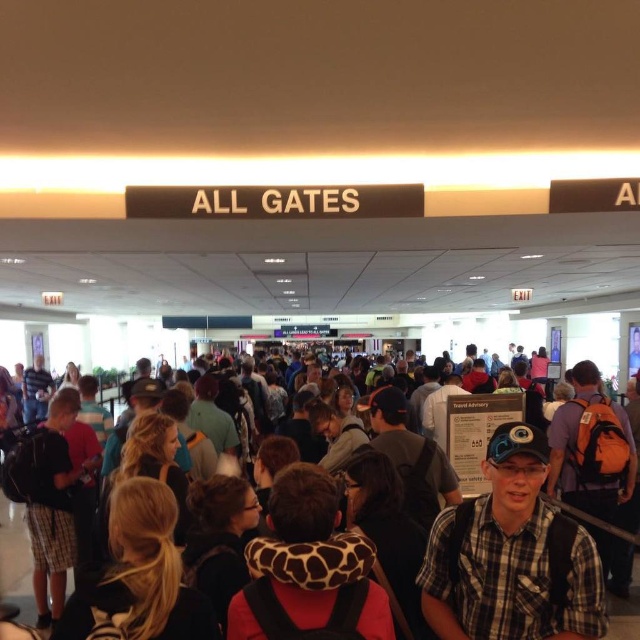
From the picture: Does plaid fabric shirt at center lie behind multicolored backpacks at center?

No, it is in front of multicolored backpacks at center.

Who is positioned more to the right, plaid fabric shirt at center or multicolored backpacks at center?

From the viewer's perspective, plaid fabric shirt at center appears more on the right side.

Who is more distant from viewer, (x=468, y=564) or (x=632, y=589)?

The point (x=632, y=589) is behind.

Locate an element on the screen. Image resolution: width=640 pixels, height=640 pixels. plaid fabric shirt at center is located at coordinates (512, 556).

Is giraffe-patterned neck pillow at center behind plaid shorts at left?

No.

Who is more forward, (301,605) or (51,611)?

Point (301,605) is more forward.

Is point (296, 492) positioned after point (49, 413)?

No, it is not.

The height and width of the screenshot is (640, 640). I want to click on giraffe-patterned neck pillow at center, so (x=308, y=570).

Does plaid fabric shirt at center lie behind plaid shorts at left?

That is False.

Which is in front, point (499, 540) or point (33, 481)?

Positioned in front is point (499, 540).

Locate an element on the screen. This screenshot has width=640, height=640. plaid fabric shirt at center is located at coordinates (512, 556).